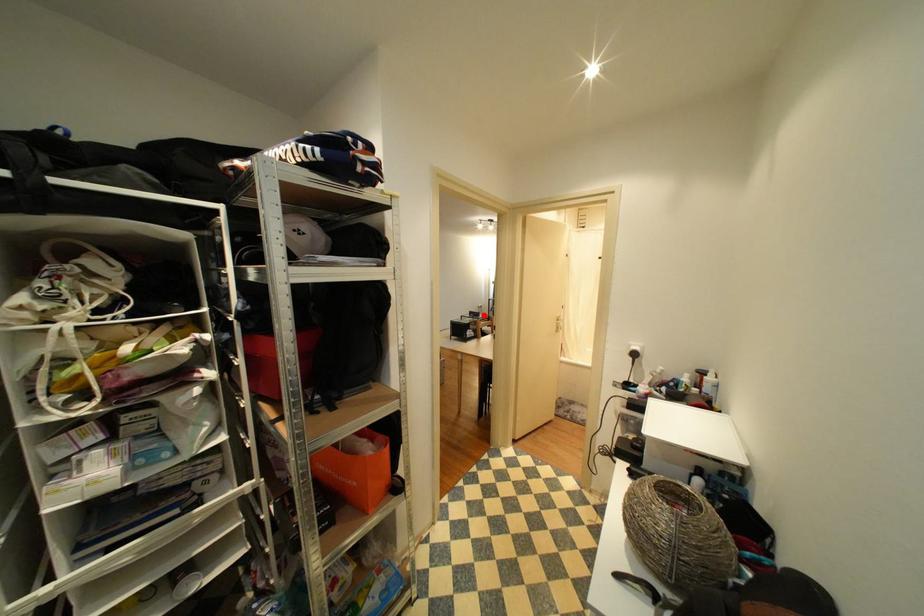
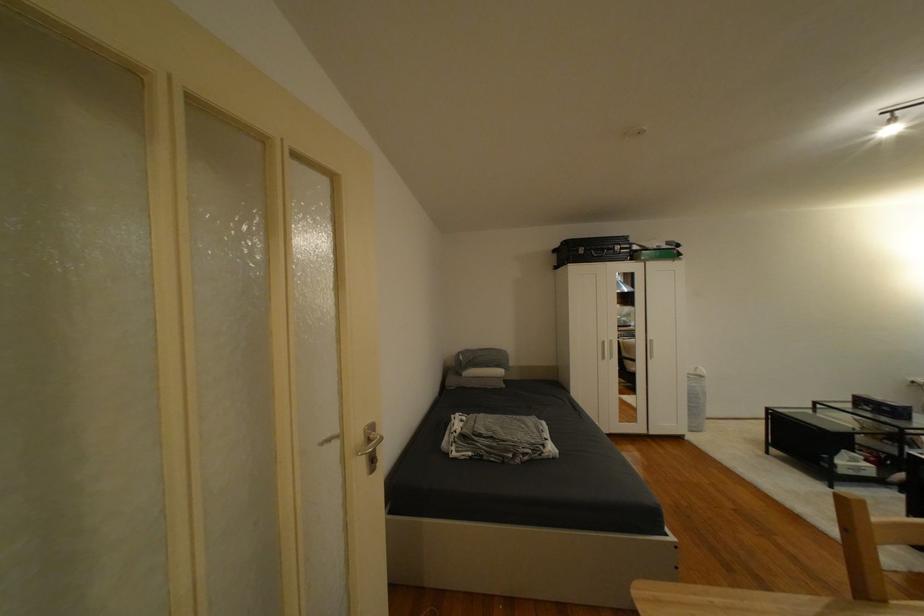
In the second image, find the point that corresponds to the highlighted location in the first image.

(894, 410)